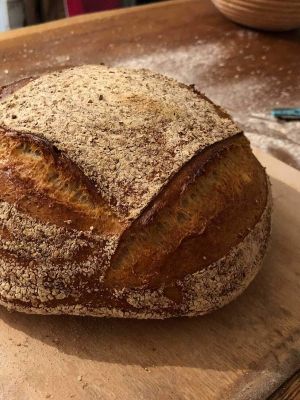
You are a GUI agent. You are given a task and a screenshot of the screen. Output one action in this format:
    pyautogui.click(x=<x>, y=<y>)
    Task: Click on the bowl
    
    Given the screenshot: What is the action you would take?
    pyautogui.click(x=278, y=17)